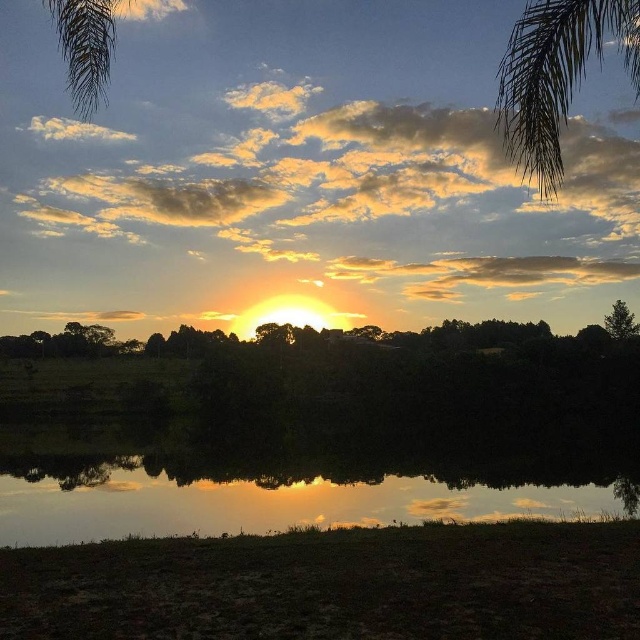
Who is positioned more to the left, green leafy palm tree at upper right or green leafy palm tree at upper left?

From the viewer's perspective, green leafy palm tree at upper left appears more on the left side.

Does point (627, 60) come in front of point (54, 28)?

Yes, point (627, 60) is closer to viewer.

Find the location of `green leafy palm tree at upper right`. green leafy palm tree at upper right is located at coordinates (556, 76).

Is glossy reflective water at center to the right of green leafy palm tree at upper left from the viewer's perspective?

Correct, you'll find glossy reflective water at center to the right of green leafy palm tree at upper left.

Does glossy reflective water at center have a greater width compared to green leafy palm tree at upper left?

No.

Consider the image. Who is more distant from viewer, (480, 512) or (99, 76)?

The point (480, 512) is behind.

The image size is (640, 640). I want to click on glossy reflective water at center, so click(x=296, y=481).

Between point (364, 477) and point (628, 323), which one is positioned in front?

Point (364, 477)

The width and height of the screenshot is (640, 640). I want to click on glossy reflective water at center, so click(296, 481).